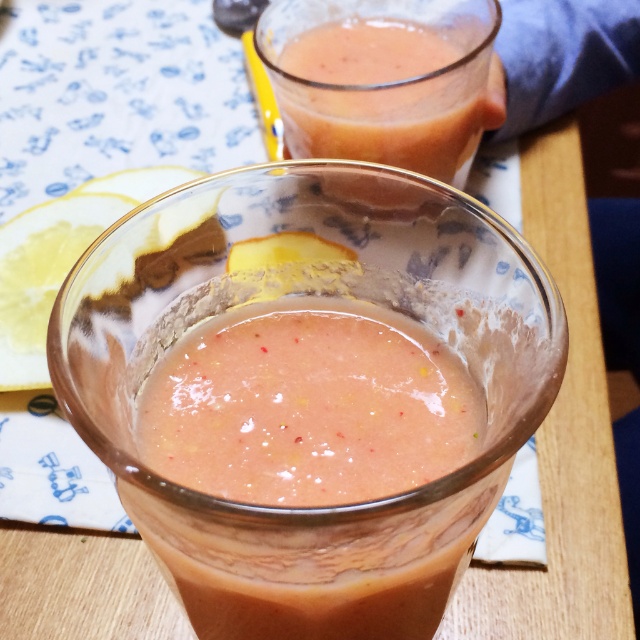
You are at the table and want to reach for the smoothie closest to you. Which point should you reach towards, point (278, 532) or point (284, 60)?

Point (278, 532) is in front of point (284, 60), so you should reach towards point (278, 532) to get the closest smoothie.

You are a bartender who needs to place a new glass exactly at the center of the table. The table has a coordinate system where the bottom left corner is the origin. Given the existing objects on the table, can you confirm if the point at coordinates (320, 563) is suitable for placing the new glass without overlapping any existing items?

The point at coordinates (320, 563) has a pink frothy smoothie at center, so placing a new glass there would overlap with the existing pink frothy smoothie at center. Choose a different location.

Where is the pink frothy smoothie at center located in the image?

The pink frothy smoothie at center is located at point (320, 563) in the image.